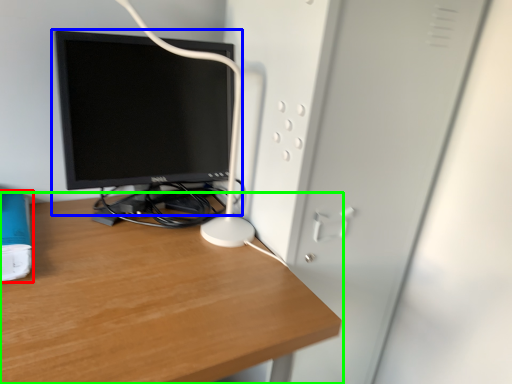
Question: Which is farther away from paperback book (highlighted by a red box)? computer monitor (highlighted by a blue box) or desk (highlighted by a green box)?

Choices:
 (A) computer monitor
 (B) desk

Answer: (A)